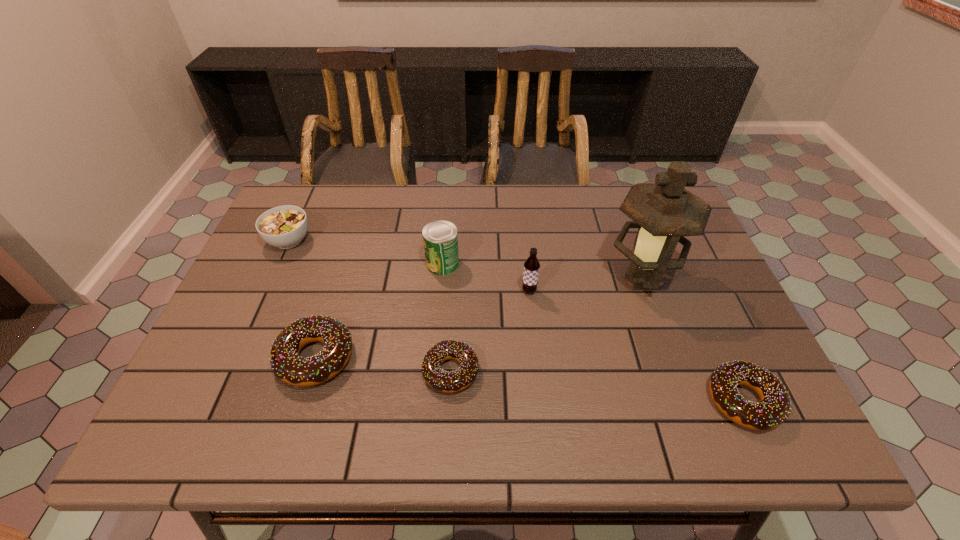
Please point a location where one more doughnut can be added evenly. Please provide its 2D coordinates. Your answer should be formatted as a tuple, i.e. [(x, y)], where the tuple contains the x and y coordinates of a point satisfying the conditions above.

[(593, 386)]